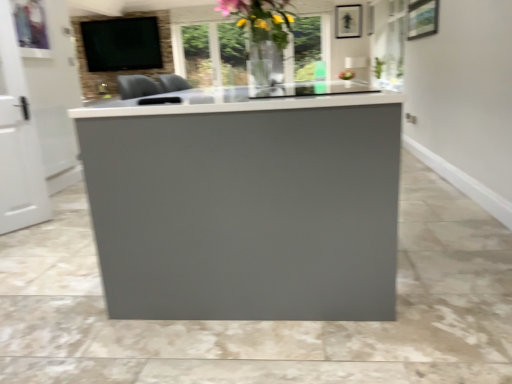
Question: Can you confirm if green leafy plant at upper right is thinner than white glossy door at left?

Choices:
 (A) no
 (B) yes

Answer: (A)

Question: From a real-world perspective, is green leafy plant at upper right positioned over white glossy door at left based on gravity?

Choices:
 (A) yes
 (B) no

Answer: (A)

Question: From the image's perspective, does green leafy plant at upper right appear lower than white glossy door at left?

Choices:
 (A) yes
 (B) no

Answer: (B)

Question: Does green leafy plant at upper right appear on the left side of white glossy door at left?

Choices:
 (A) yes
 (B) no

Answer: (B)

Question: Does green leafy plant at upper right contain white glossy door at left?

Choices:
 (A) no
 (B) yes

Answer: (A)

Question: Considering the positions of point (373, 62) and point (26, 139), is point (373, 62) closer or farther from the camera than point (26, 139)?

Choices:
 (A) farther
 (B) closer

Answer: (A)

Question: In the image, is green leafy plant at upper right on the left side or the right side of white glossy door at left?

Choices:
 (A) right
 (B) left

Answer: (A)

Question: Would you say green leafy plant at upper right is inside or outside white glossy door at left?

Choices:
 (A) outside
 (B) inside

Answer: (A)

Question: Relative to white glossy door at left, is green leafy plant at upper right in front or behind?

Choices:
 (A) behind
 (B) front

Answer: (A)

Question: Visually, is matte black tv at upper left positioned to the left or to the right of green leafy plant at upper right?

Choices:
 (A) right
 (B) left

Answer: (B)

Question: Looking at their shapes, would you say matte black tv at upper left is wider or thinner than green leafy plant at upper right?

Choices:
 (A) thin
 (B) wide

Answer: (A)

Question: Based on their sizes in the image, would you say matte black tv at upper left is bigger or smaller than green leafy plant at upper right?

Choices:
 (A) big
 (B) small

Answer: (A)

Question: In terms of height, does matte black tv at upper left look taller or shorter compared to green leafy plant at upper right?

Choices:
 (A) tall
 (B) short

Answer: (A)

Question: In the image, is matte black picture frame at upper center on the left side or the right side of matte black tv at upper left?

Choices:
 (A) left
 (B) right

Answer: (B)

Question: Considering the positions of point (357, 19) and point (120, 46), is point (357, 19) closer or farther from the camera than point (120, 46)?

Choices:
 (A) closer
 (B) farther

Answer: (B)